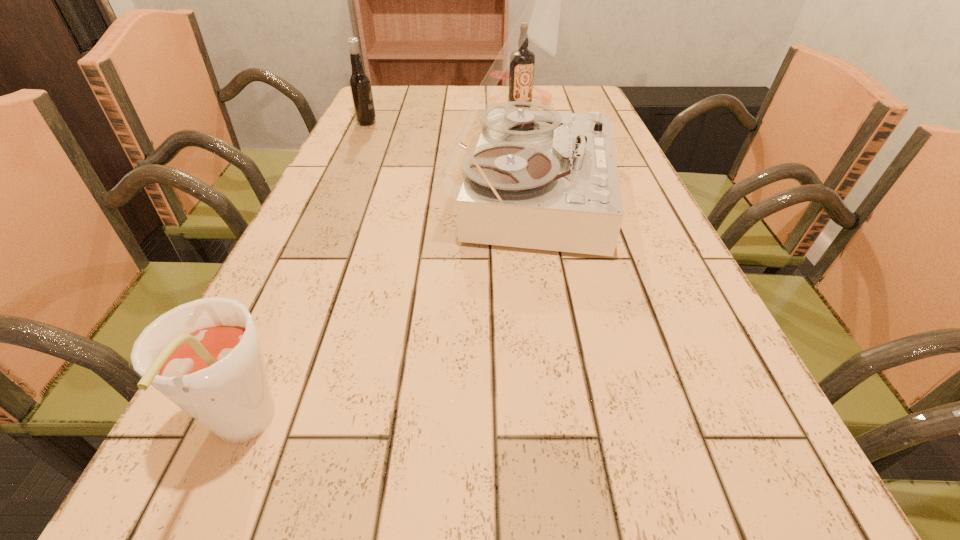
You are a GUI agent. You are given a task and a screenshot of the screen. Output one action in this format:
    pyautogui.click(x=<x>, y=<y>)
    Task: Click on the second nearest object
    
    Given the screenshot: What is the action you would take?
    pyautogui.click(x=543, y=180)

The image size is (960, 540). In order to click on record player in this screenshot , I will do `click(543, 180)`.

The image size is (960, 540). I want to click on the farthest root beer, so [521, 74].

You are a GUI agent. You are given a task and a screenshot of the screen. Output one action in this format:
    pyautogui.click(x=<x>, y=<y>)
    Task: Click on the farthest object
    The width and height of the screenshot is (960, 540).
    Given the screenshot: What is the action you would take?
    pyautogui.click(x=521, y=74)

Locate an element on the screen. the third nearest object is located at coordinates (360, 86).

Identify the location of the nearest root beer. (205, 356).

The width and height of the screenshot is (960, 540). I want to click on free region located on the front of the tallest object, so click(x=558, y=360).

Identify the location of vacant space located 0.110m on the label of the farthest root beer. (525, 134).

You are a GUI agent. You are given a task and a screenshot of the screen. Output one action in this format:
    pyautogui.click(x=<x>, y=<y>)
    Task: Click on the blank space located 0.110m on the label of the second farthest object
    The width and height of the screenshot is (960, 540).
    Given the screenshot: What is the action you would take?
    pyautogui.click(x=414, y=123)

Find the location of a particular element. The width and height of the screenshot is (960, 540). object at the far edge is located at coordinates pos(521,74).